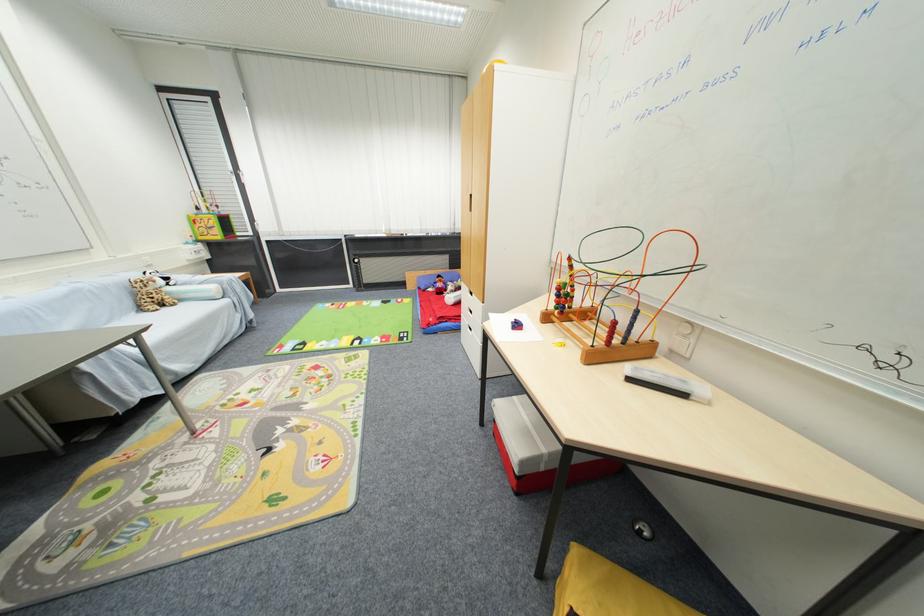
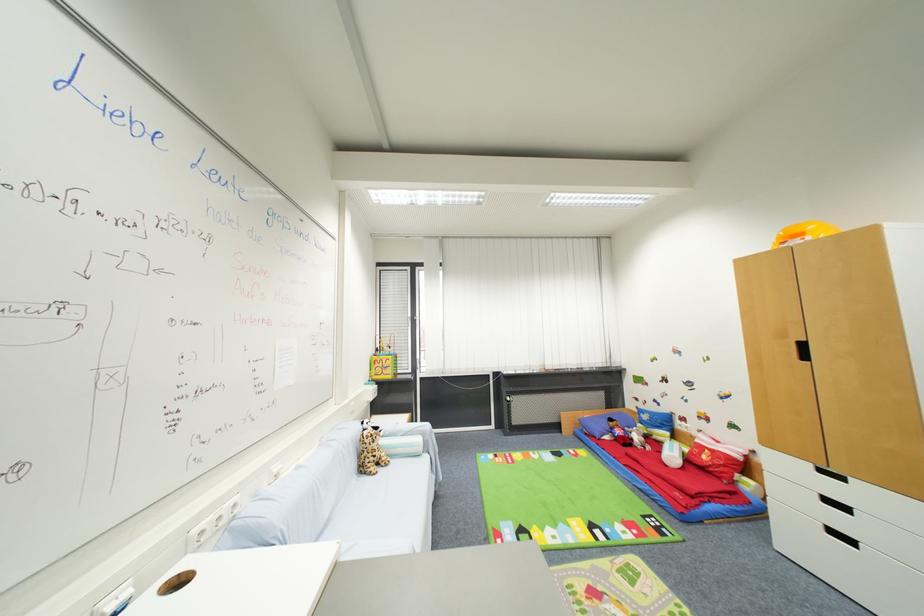
Find the pixel in the second image that matches the point at 477,199 in the first image.

(808, 346)